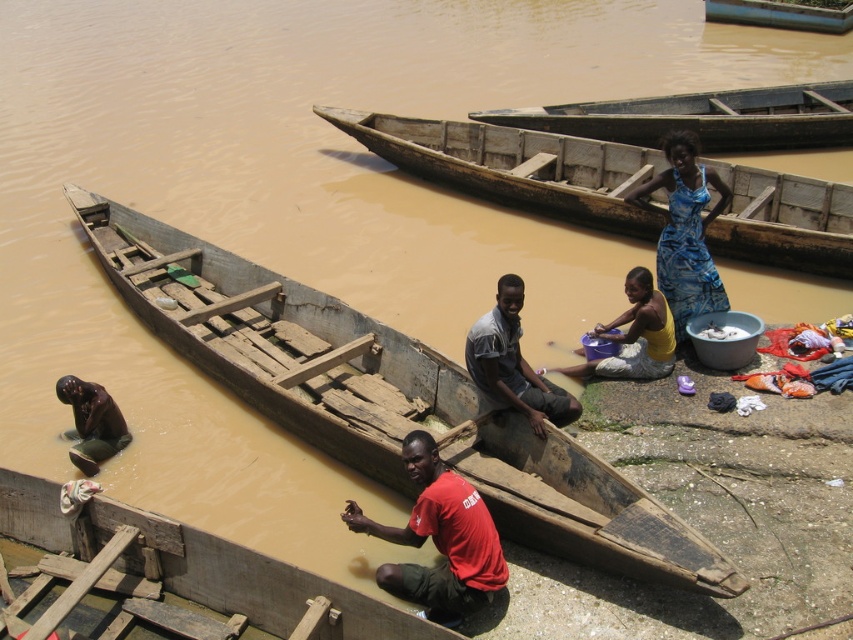
Is wooden canoe at center smaller than gray fabric shirt at center?

Yes, wooden canoe at center is smaller than gray fabric shirt at center.

Between wooden canoe at center and gray fabric shirt at center, which one appears on the right side from the viewer's perspective?

gray fabric shirt at center

Identify the location of wooden canoe at center. This screenshot has height=640, width=853. (279, 340).

Between point (44, 586) and point (526, 384), which one is positioned in front?

Positioned in front is point (44, 586).

Image resolution: width=853 pixels, height=640 pixels. What do you see at coordinates (167, 579) in the screenshot? I see `wooden canoe at lower center` at bounding box center [167, 579].

Is point (276, 588) farther from camera compared to point (469, 371)?

No, it is not.

This screenshot has height=640, width=853. I want to click on wooden canoe at lower center, so click(x=167, y=579).

Can you confirm if gray fabric shirt at center is positioned to the right of yellow matte bucket at center?

No, gray fabric shirt at center is not to the right of yellow matte bucket at center.

Is gray fabric shirt at center bigger than yellow matte bucket at center?

No, gray fabric shirt at center is not bigger than yellow matte bucket at center.

Is point (514, 358) positioned after point (663, 349)?

No, it is in front of (663, 349).

Image resolution: width=853 pixels, height=640 pixels. I want to click on gray fabric shirt at center, so click(x=514, y=364).